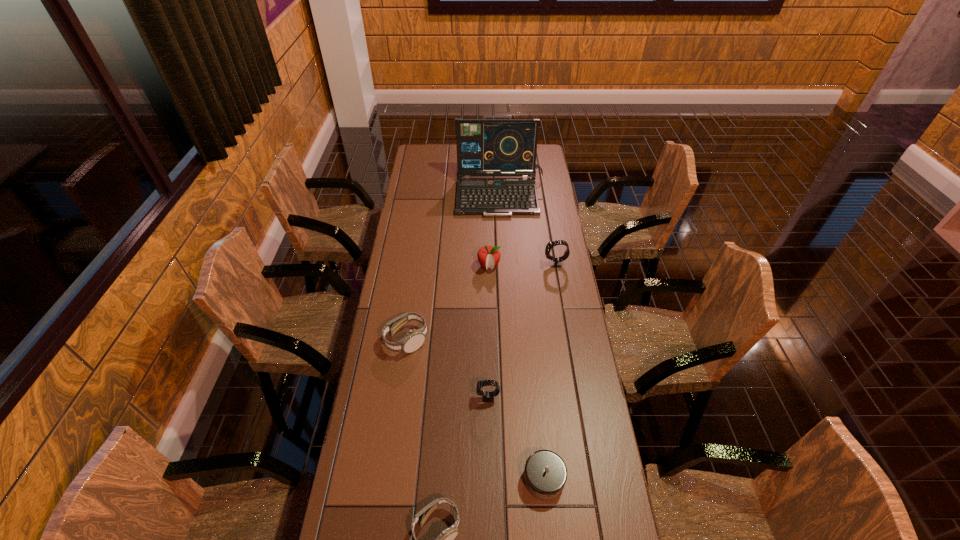
Identify the location of vacant region located on the front of the apple. (489, 285).

At what (x,y) coordinates should I click in order to perform the action: click on free space located on the face of the third farthest watch. Please return your answer as a coordinate pair (x, y). Looking at the image, I should click on (512, 340).

Identify the location of free spot located 0.350m on the back of the chocolate cake. (532, 356).

At what (x,y) coordinates should I click in order to perform the action: click on free spot located on the face of the nearest gray watch. Please return your answer as a coordinate pair (x, y). Looking at the image, I should click on (439, 397).

At what (x,y) coordinates should I click in order to perform the action: click on free spot located on the face of the nearest gray watch. Please return your answer as a coordinate pair (x, y). The image size is (960, 540). Looking at the image, I should click on (455, 397).

Where is `vacant space located on the face of the nearest gray watch`? This screenshot has height=540, width=960. vacant space located on the face of the nearest gray watch is located at coordinates (379, 397).

Find the location of `object that is at the far edge`. object that is at the far edge is located at coordinates (0, 0).

Find the location of a particular element. object that is at the left edge is located at coordinates (0, 0).

In order to click on laptop computer that is at the right edge in this screenshot , I will do 0,0.

Find the location of a particular element. The height and width of the screenshot is (540, 960). watch situated at the right edge is located at coordinates (0, 0).